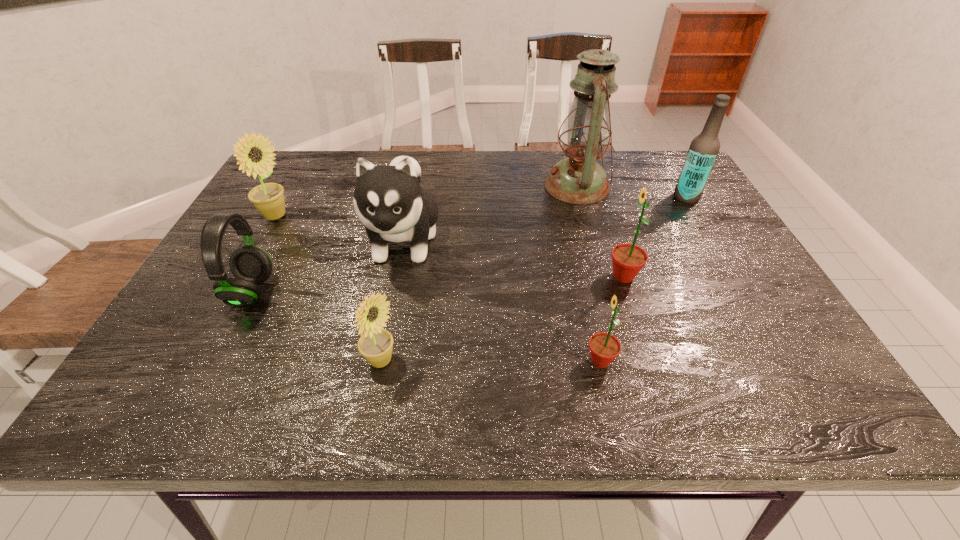
Identify the location of the left green sunflower. This screenshot has height=540, width=960. tap(604, 348).

Identify the location of the smaller green sunflower. The image size is (960, 540). (604, 348).

You are a GUI agent. You are given a task and a screenshot of the screen. Output one action in this format:
    pyautogui.click(x=<x>, y=<y>)
    Task: Click on the vacant space positioned on the left of the oil lamp
    This screenshot has width=960, height=540.
    Given the screenshot: What is the action you would take?
    pyautogui.click(x=422, y=186)

Locate an element on the screen. Image resolution: width=960 pixels, height=540 pixels. blank area located on the label of the rightmost object is located at coordinates (632, 197).

This screenshot has height=540, width=960. What are the coordinates of `free spot located on the label of the rightmost object` in the screenshot? It's located at [x=603, y=197].

You are a GUI agent. You are given a task and a screenshot of the screen. Output one action in this format:
    pyautogui.click(x=<x>, y=<y>)
    Task: Click on the free spot located 0.340m on the label of the rightmost object
    Image resolution: width=960 pixels, height=540 pixels.
    Given the screenshot: What is the action you would take?
    pyautogui.click(x=554, y=197)

Find the location of a particular element. The width and height of the screenshot is (960, 540). free location located 0.120m at the face of the puppy is located at coordinates (386, 330).

At what (x,y) coordinates should I click in order to perform the action: click on free space located on the face of the farthest sunflower. Please return your answer as a coordinate pair (x, y). The width and height of the screenshot is (960, 540). Looking at the image, I should click on (322, 217).

Image resolution: width=960 pixels, height=540 pixels. Identify the location of vacant area situated on the face of the rightmost sunflower. (581, 276).

You are a GUI agent. You are given a task and a screenshot of the screen. Output one action in this format:
    pyautogui.click(x=<x>, y=<y>)
    Task: Click on the vacant space located on the face of the rightmost sunflower
    This screenshot has width=960, height=540.
    Given the screenshot: What is the action you would take?
    coord(455,276)